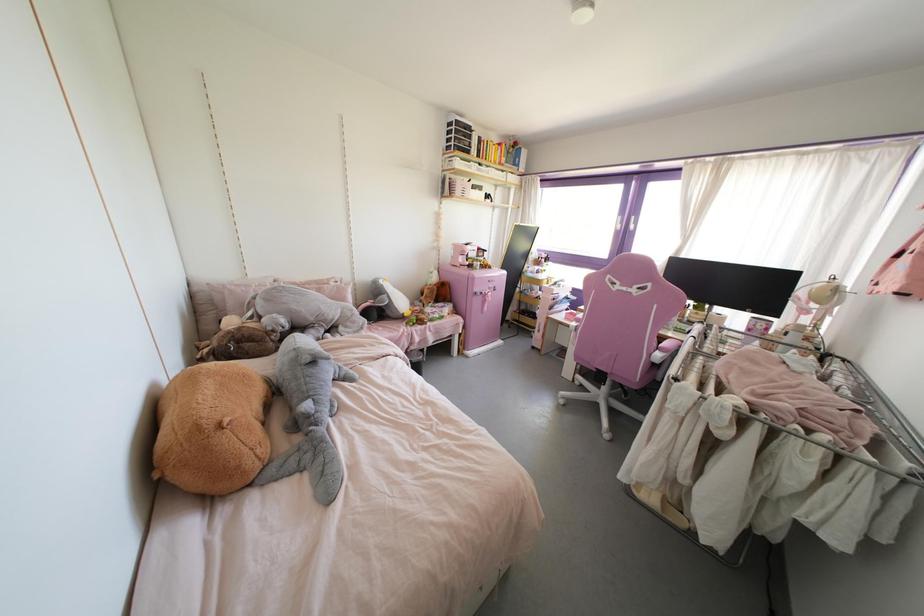
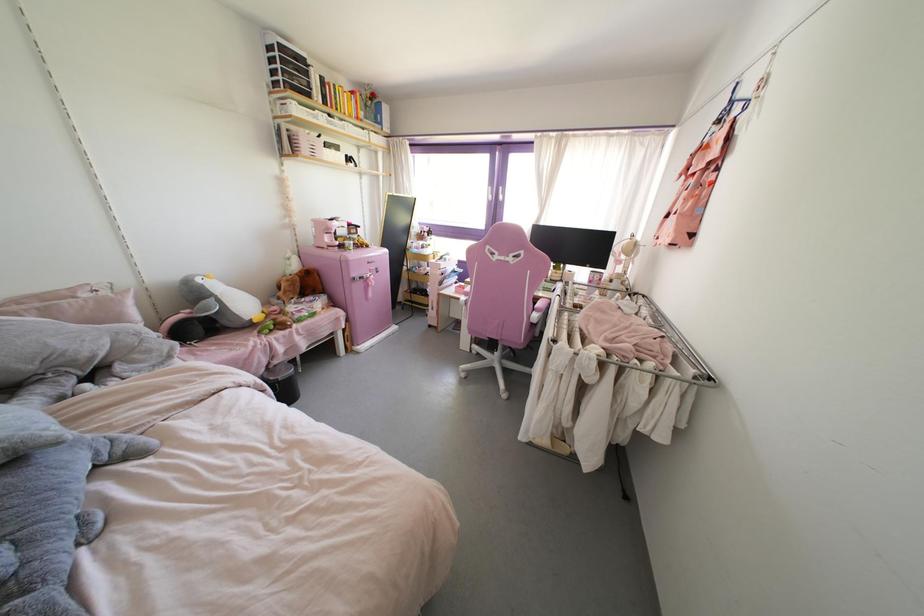
Where in the second image is the point corresponding to point 658,355 from the first image?

(535, 315)